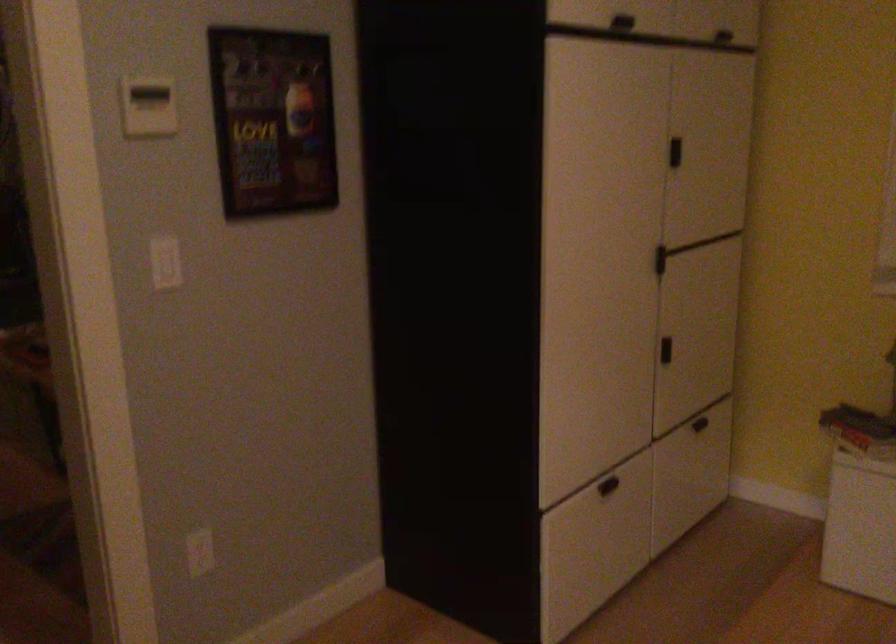
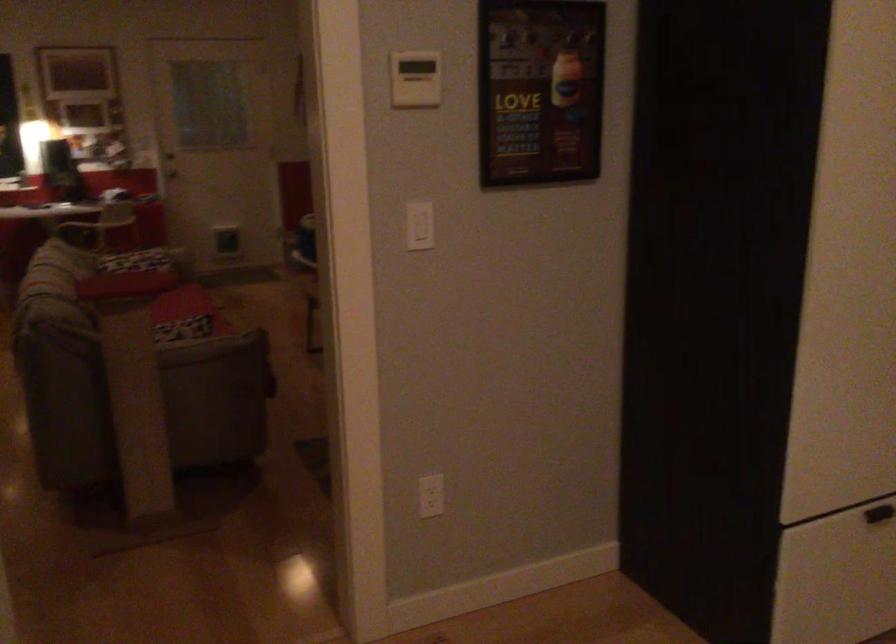
The point at (165, 267) is marked in the first image. Where is the corresponding point in the second image?

(419, 225)